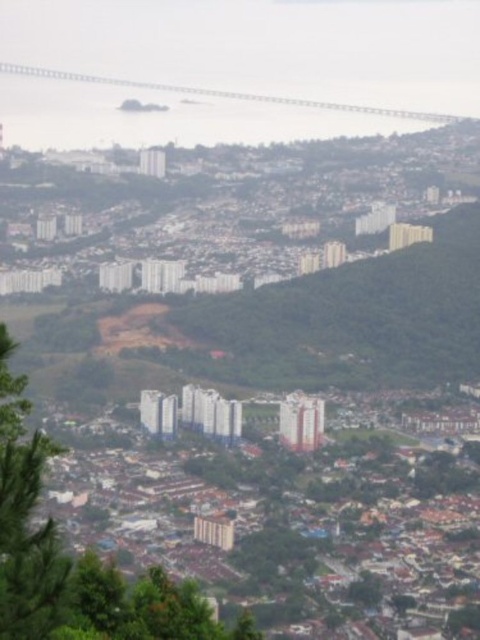
You are standing at the center of the image and want to locate the green leafy tree at lower left. In which direction should you look to find it?

The green leafy tree at lower left is located at the bottom left corner of the image, so you should look downward and to the left from the center to find it.

You are an urban planner reviewing this area. You need to determine if the green leafy tree at lower left can be safely removed without affecting the structural integrity of the metallic gray bridge at upper left. Based on their positions, is this possible?

The green leafy tree at lower left is positioned under the metallic gray bridge at upper left. Since the tree is directly underneath the bridge, removing it might affect the bridge structure, so it is not safe to remove the tree.

You are a city planner analyzing the urban layout. You need to determine which of the two structures, the green leafy tree at lower left or the metallic gray bridge at upper left, has a narrower width. Which one is it?

The green leafy tree at lower left is thinner than the metallic gray bridge at upper left, so the green leafy tree at lower left has a narrower width.